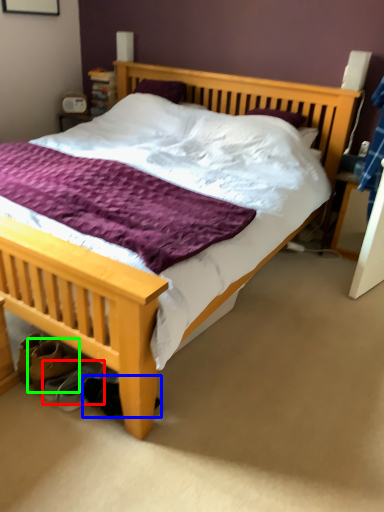
Question: Which is nearer to the shoe (highlighted by a red box)? shoe (highlighted by a blue box) or footwear (highlighted by a green box).

Choices:
 (A) shoe
 (B) footwear

Answer: (B)